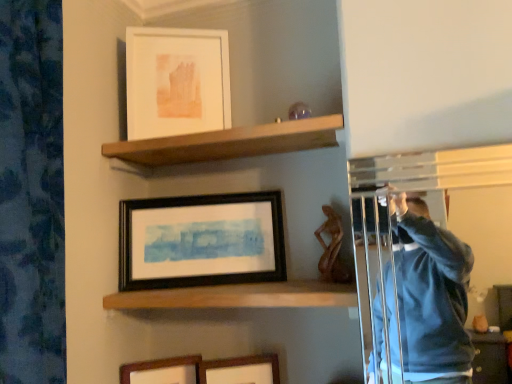
Locate an element on the screen. The image size is (512, 384). empty space that is ontop of wooden shelf at center, which is the 2th shelf in top-to-bottom order (from a real-world perspective) is located at coordinates (232, 279).